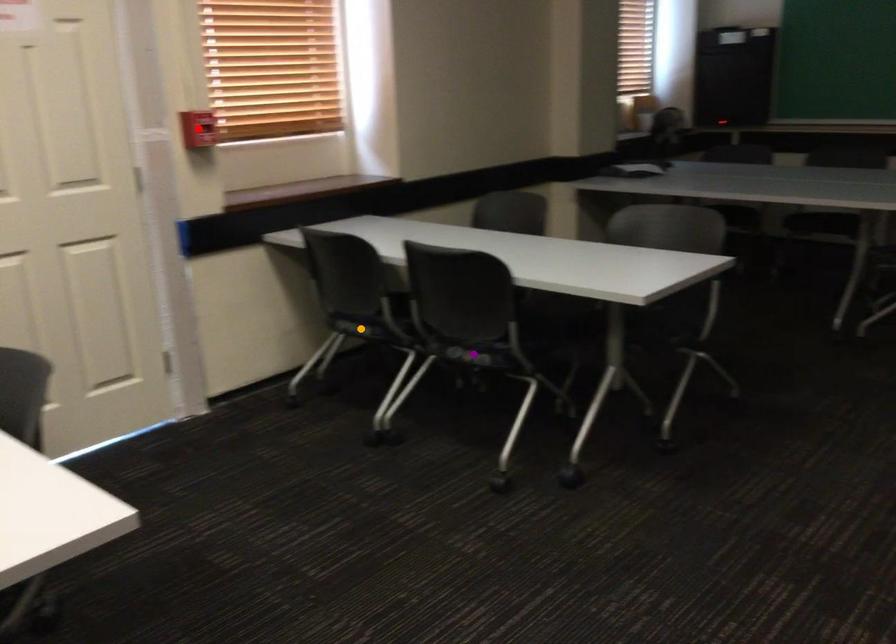
Order these from nearest to farthest:
red point
orange point
purple point

orange point < red point < purple point